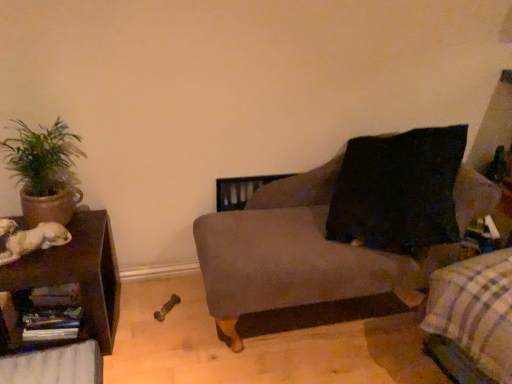
Question: From a real-world perspective, is brown wood table at left on top of green leafy plant in clay pot at left?

Choices:
 (A) no
 (B) yes

Answer: (A)

Question: Does brown wood table at left lie behind green leafy plant in clay pot at left?

Choices:
 (A) yes
 (B) no

Answer: (B)

Question: Would you say brown wood table at left is a long distance from green leafy plant in clay pot at left?

Choices:
 (A) yes
 (B) no

Answer: (B)

Question: Does brown wood table at left appear on the right side of green leafy plant in clay pot at left?

Choices:
 (A) no
 (B) yes

Answer: (A)

Question: Does brown wood table at left lie in front of green leafy plant in clay pot at left?

Choices:
 (A) yes
 (B) no

Answer: (A)

Question: Is white fur dog at left inside or outside of green leafy plant in clay pot at left?

Choices:
 (A) outside
 (B) inside

Answer: (A)

Question: Looking at their shapes, would you say white fur dog at left is wider or thinner than green leafy plant in clay pot at left?

Choices:
 (A) thin
 (B) wide

Answer: (B)

Question: In terms of size, does white fur dog at left appear bigger or smaller than green leafy plant in clay pot at left?

Choices:
 (A) big
 (B) small

Answer: (B)

Question: From a real-world perspective, is white fur dog at left above or below green leafy plant in clay pot at left?

Choices:
 (A) below
 (B) above

Answer: (A)

Question: Relative to green leafy plant in clay pot at left, is brown wood table at left in front or behind?

Choices:
 (A) behind
 (B) front

Answer: (B)

Question: From a real-world perspective, is brown wood table at left above or below green leafy plant in clay pot at left?

Choices:
 (A) below
 (B) above

Answer: (A)

Question: Is point (61, 281) positioned closer to the camera than point (35, 218)?

Choices:
 (A) farther
 (B) closer

Answer: (B)

Question: From the image's perspective, is brown wood table at left above or below green leafy plant in clay pot at left?

Choices:
 (A) below
 (B) above

Answer: (A)

Question: In terms of width, does wooden shelf at lower left look wider or thinner when compared to velvet gray couch at center?

Choices:
 (A) thin
 (B) wide

Answer: (A)

Question: Choose the correct answer: Is wooden shelf at lower left inside velvet gray couch at center or outside it?

Choices:
 (A) inside
 (B) outside

Answer: (B)